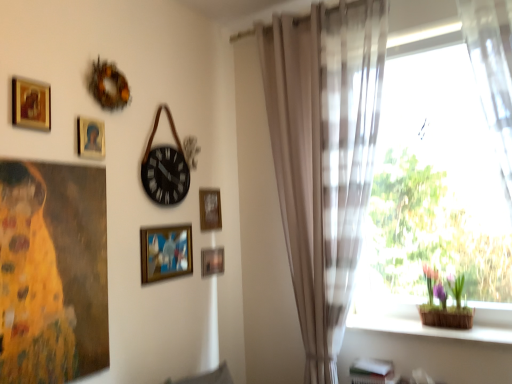
Locate an element on the screen. This screenshot has height=384, width=512. vacant area on top of green leafy plant at right (from a real-world perspective) is located at coordinates (442, 262).